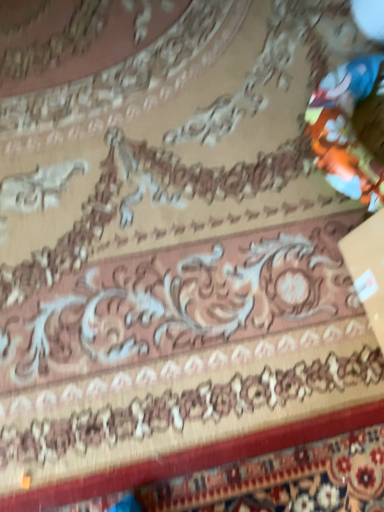
The width and height of the screenshot is (384, 512). What do you see at coordinates (351, 128) in the screenshot?
I see `orange fabric toy at upper right` at bounding box center [351, 128].

Where is `orange fabric toy at upper right`? orange fabric toy at upper right is located at coordinates (351, 128).

What is the approximate height of orange fabric toy at upper right?

orange fabric toy at upper right is 5.84 inches tall.

Find the location of a particular element. The image size is (384, 512). orange fabric toy at upper right is located at coordinates (351, 128).